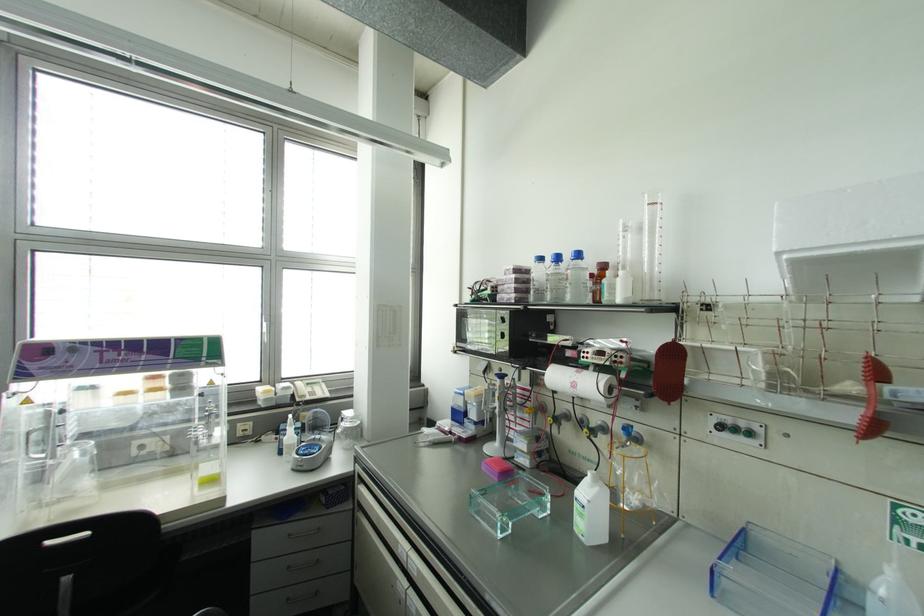
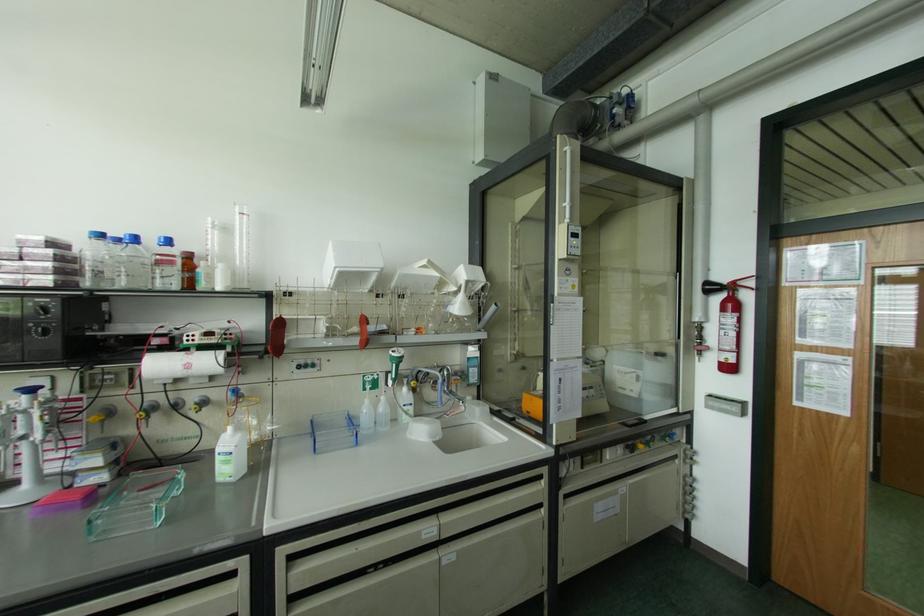
Where in the second image is the point corresponding to (574,384) from the first image?

(188, 366)